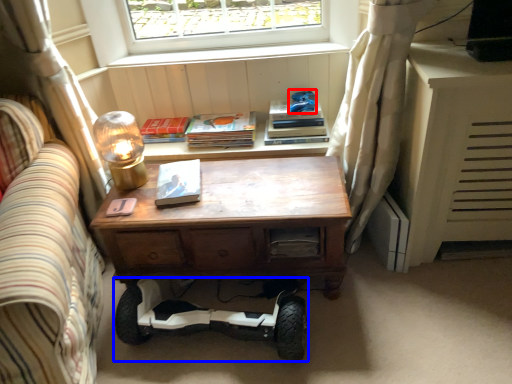
Question: Which object is further to the camera taking this photo, toy (highlighted by a red box) or segway (highlighted by a blue box)?

Choices:
 (A) toy
 (B) segway

Answer: (A)